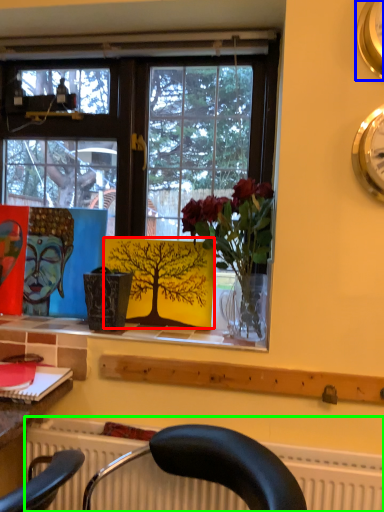
Question: Based on their relative distances, which object is nearer to plant (highlighted by a red box)? Choose from clock (highlighted by a blue box) and radiator (highlighted by a green box).

Choices:
 (A) clock
 (B) radiator

Answer: (B)